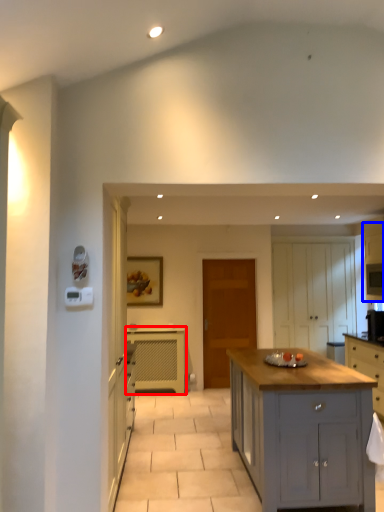
Question: Which point is further to the camera, cabinetry (highlighted by a red box) or cabinetry (highlighted by a blue box)?

Choices:
 (A) cabinetry
 (B) cabinetry

Answer: (A)